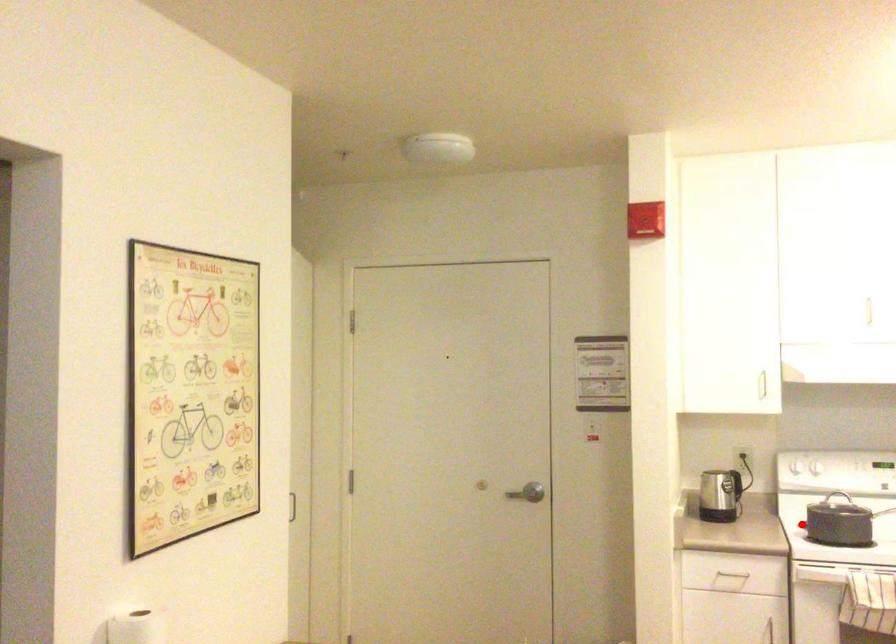
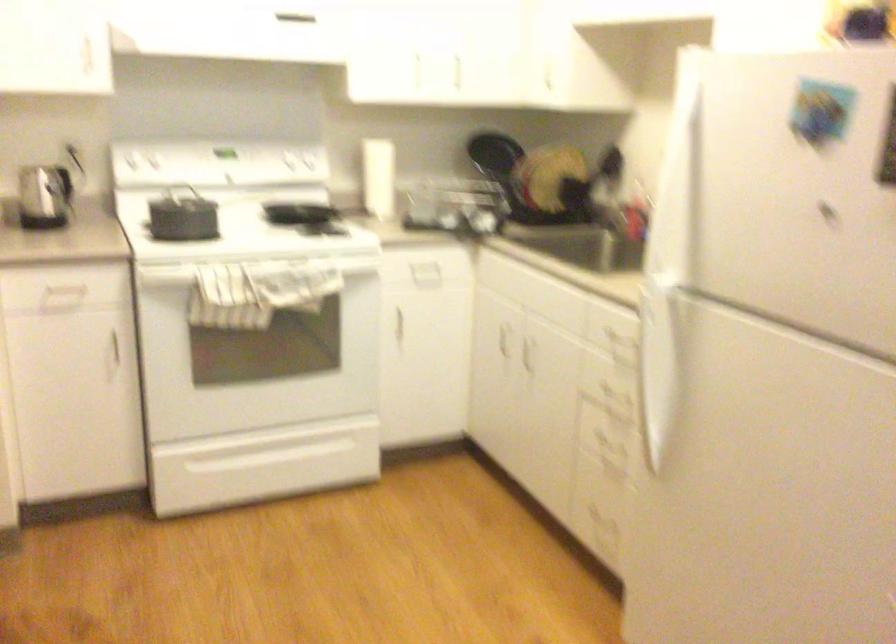
Find the pixel in the second image that matches the highlighted location in the first image.

(141, 225)